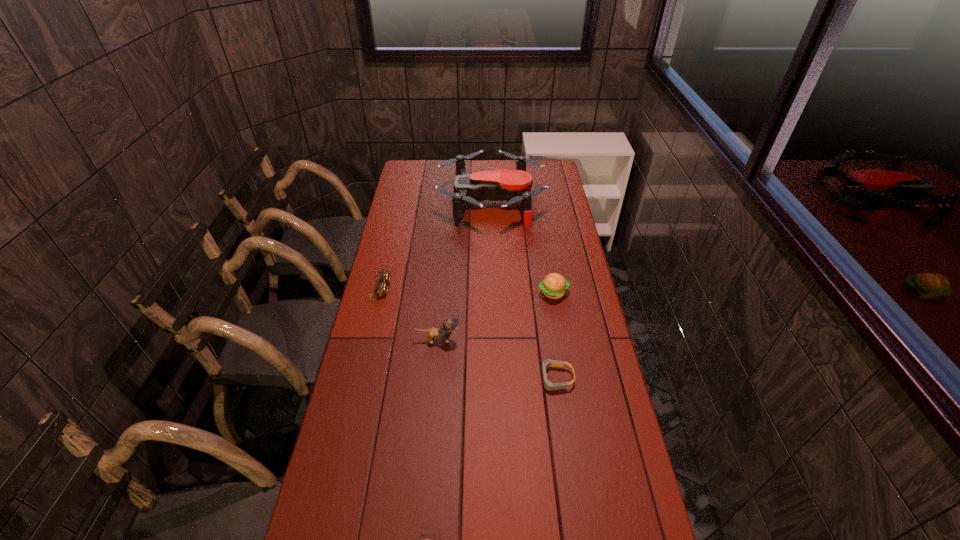
Image resolution: width=960 pixels, height=540 pixels. I want to click on drone, so click(513, 186).

Find the location of a particular element. the tallest object is located at coordinates (513, 186).

You are a GUI agent. You are given a task and a screenshot of the screen. Output one action in this format:
    pyautogui.click(x=<x>, y=<y>)
    Task: Click on the kitten
    The width and height of the screenshot is (960, 540).
    Given the screenshot: What is the action you would take?
    pyautogui.click(x=449, y=325)

You are a GUI agent. You are given a task and a screenshot of the screen. Output one action in this format:
    pyautogui.click(x=<x>, y=<y>)
    Task: Click on the third nearest object
    This screenshot has width=960, height=540.
    Given the screenshot: What is the action you would take?
    pyautogui.click(x=449, y=325)

Identify the location of the fourth shortest object. The width and height of the screenshot is (960, 540). (554, 285).

This screenshot has height=540, width=960. What are the coordinates of `the third shortest object` in the screenshot? It's located at (381, 287).

At what (x,y) coordinates should I click in order to perform the action: click on the tallest goggles. Please return your answer as a coordinate pair (x, y). Looking at the image, I should click on (381, 287).

In order to click on the second nearest goggles in this screenshot , I will do `click(548, 385)`.

You are a GUI agent. You are given a task and a screenshot of the screen. Output one action in this format:
    pyautogui.click(x=<x>, y=<y>)
    Task: Click on the rightmost goggles
    This screenshot has height=540, width=960.
    Given the screenshot: What is the action you would take?
    pyautogui.click(x=548, y=385)

The height and width of the screenshot is (540, 960). In order to click on free spot located 0.100m on the camera side of the farthest object in this screenshot , I will do `click(415, 203)`.